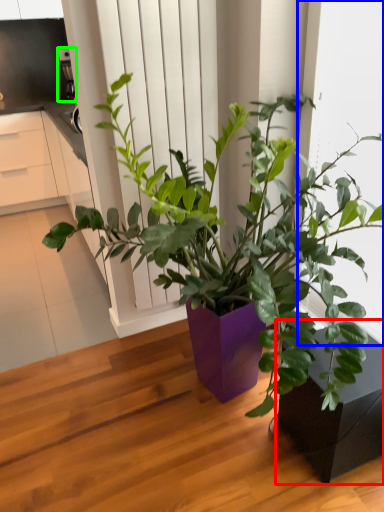
Question: Based on their relative distances, which object is farther from flowerpot (highlighted by a red box)? Choose from window frame (highlighted by a blue box) and appliance (highlighted by a green box).

Choices:
 (A) window frame
 (B) appliance

Answer: (B)